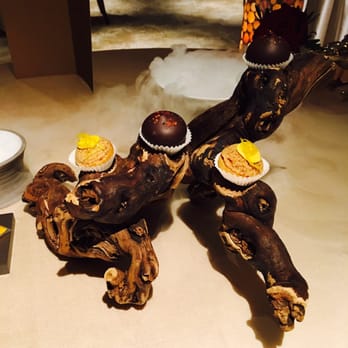
What are the coordinates of `lighting` in the screenshot? It's located at (247, 19).